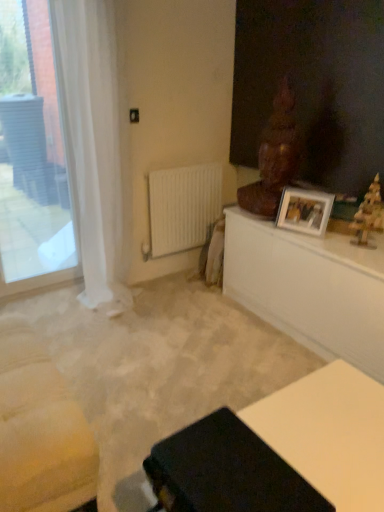
Question: Choose the correct answer: Is white glossy table at upper right, which is counted as the 1th table, starting from the top, inside white matte radiator at center or outside it?

Choices:
 (A) inside
 (B) outside

Answer: (B)

Question: In the image, is white glossy table at upper right, the 1th table when ordered from back to front, positioned in front of or behind white matte radiator at center?

Choices:
 (A) front
 (B) behind

Answer: (A)

Question: Which is farther from the white glossy table at upper right, the second table in the bottom-to-top sequence?

Choices:
 (A) wooden christmas tree at right, arranged as the 2th sculpture when viewed from the back
 (B) wooden statue at upper right, the second sculpture in the right-to-left sequence
 (C) transparent glass window at left
 (D) matte black table at lower center, which is counted as the first table, starting from the bottom
 (E) white sheer curtain at left

Answer: (C)

Question: Estimate the real-world distances between objects in this image. Which object is farther from the wooden christmas tree at right, which is the second sculpture in left-to-right order?

Choices:
 (A) white sheer curtain at left
 (B) white glossy picture frame at upper right
 (C) wooden statue at upper right, the 1th sculpture positioned from the left
 (D) white glossy table at upper right, the second table in the bottom-to-top sequence
 (E) white matte radiator at center

Answer: (A)